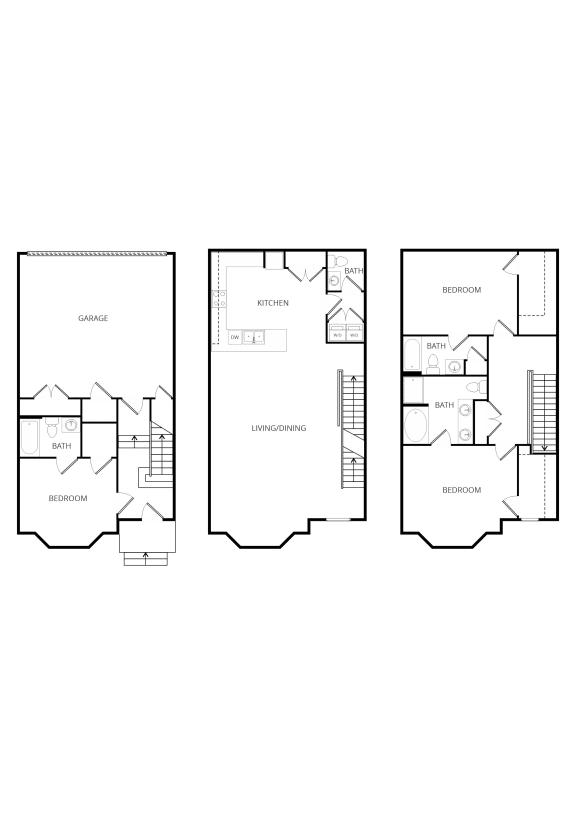
Locate an element on the screen. This screenshot has height=814, width=576. sinks is located at coordinates coord(335,287), coord(255,335), coord(69,427), coord(463,404), coord(464,438), coord(457,362).